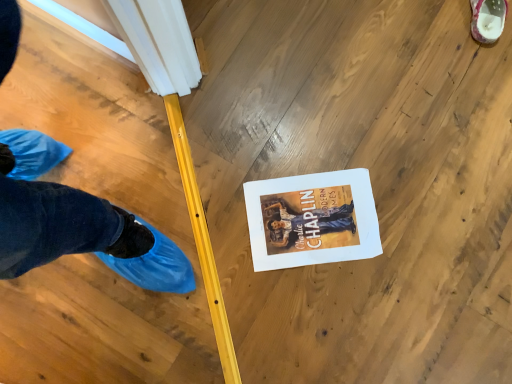
Where is `vacant area that is in front of white paper at center`? This screenshot has height=384, width=512. vacant area that is in front of white paper at center is located at coordinates (316, 318).